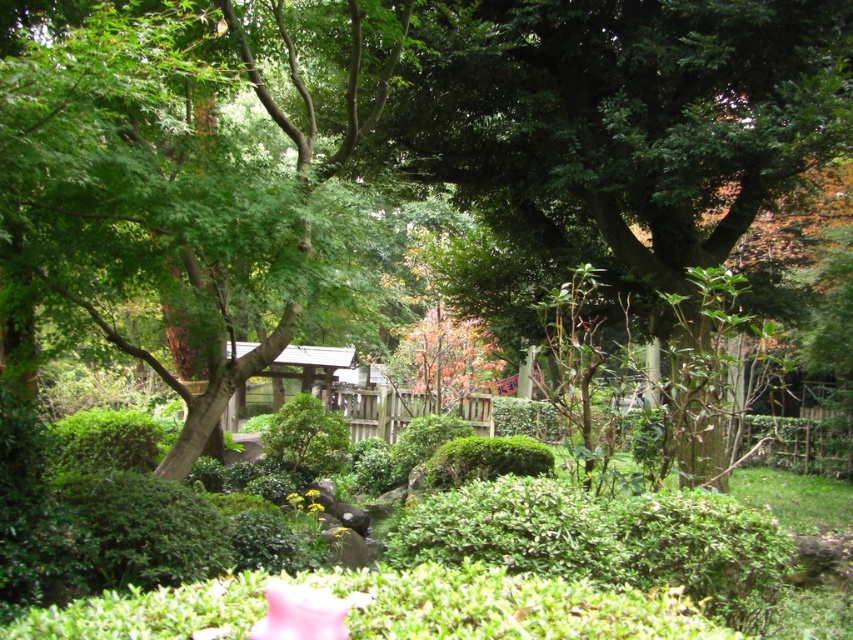
You are a gardener planning to trim the plants in the garden. You need to know which of the two plants, the green leafy tree at center or the green leafy bush at center, requires pruning first based on their height. Which one should you start with?

The green leafy tree at center is shorter than the green leafy bush at center, so you should start pruning the green leafy bush at center first since it is taller and may need attention before the shorter tree.

You are standing in the garden and see a point marked at coordinates [180,164]. According to the scene description, where exactly is this point located?

The point at coordinates [180,164] is located on the green leafy tree at center.